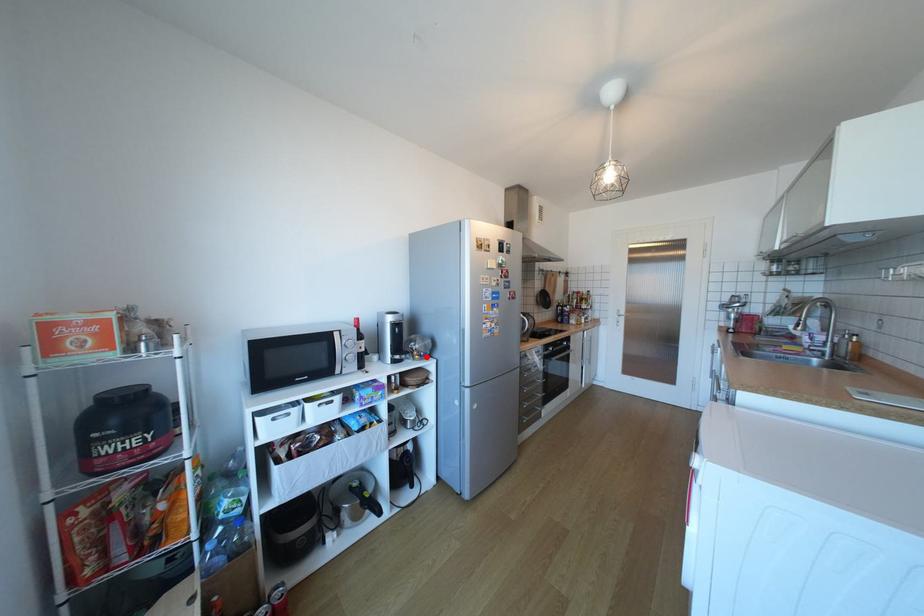
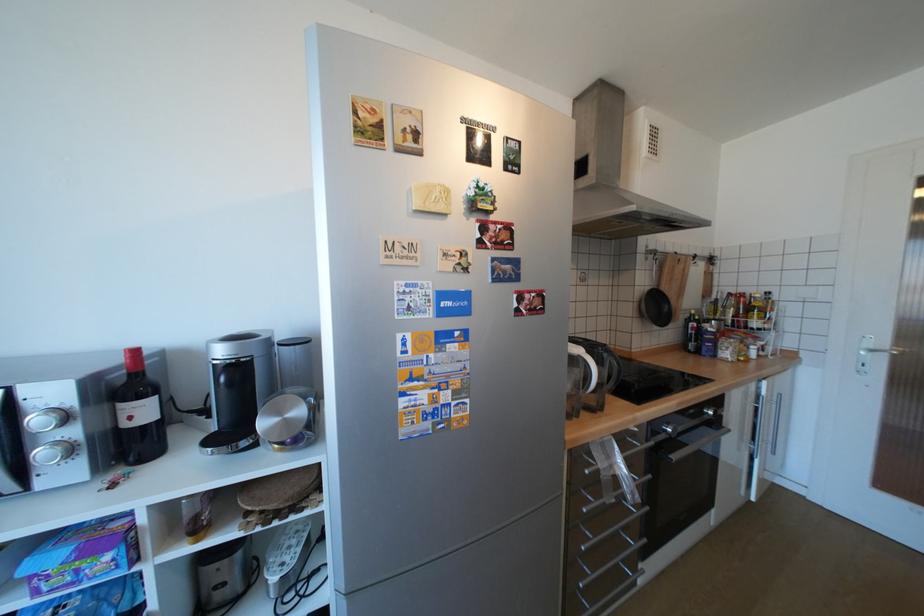
In the second image, find the point that corresponds to the highlighted location in the first image.

(286, 446)